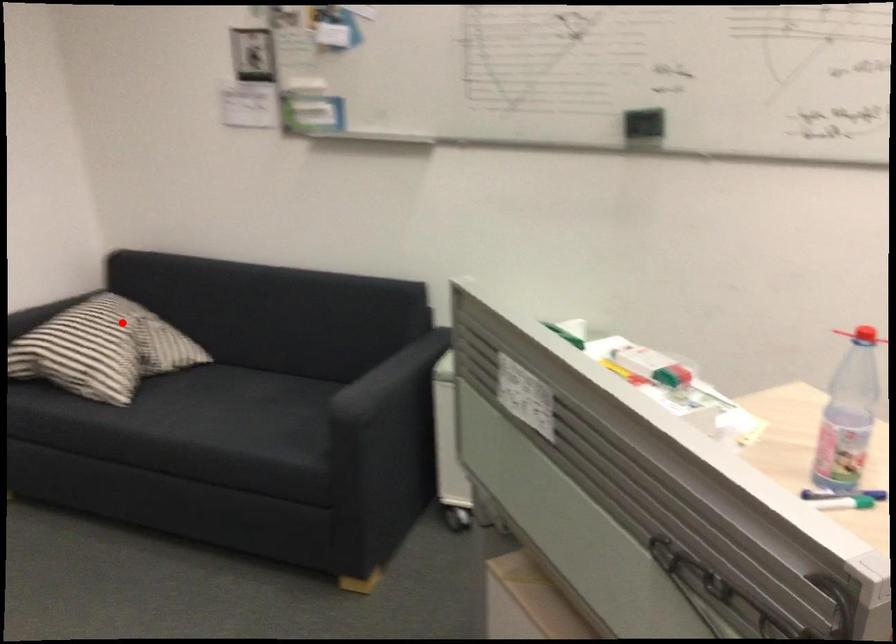
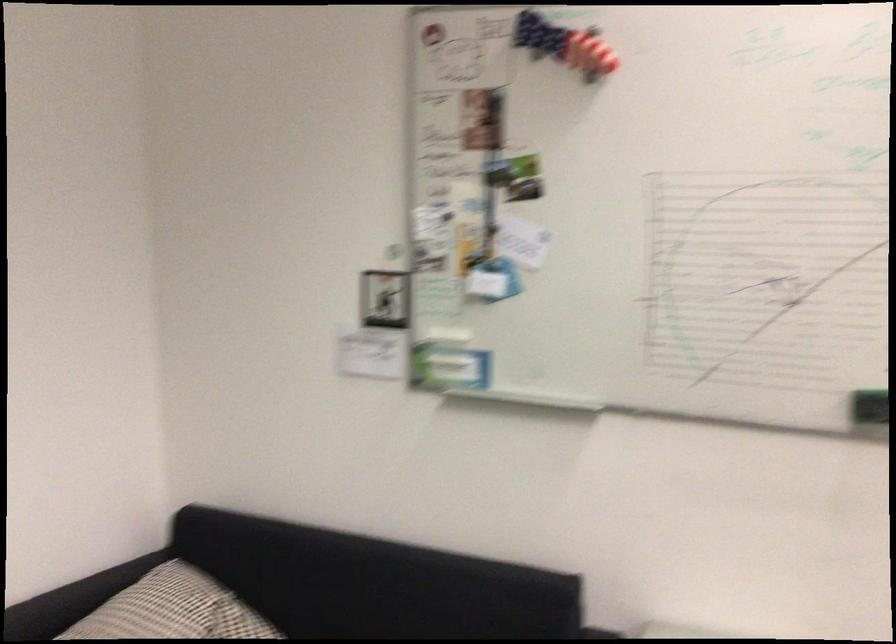
Question: I am providing you with two images of the same scene from different viewpoints. A red point is marked on the first image. At the location where the point appears in image 1, is it still visible in image 2?

Choices:
 (A) Yes
 (B) No

Answer: (A)